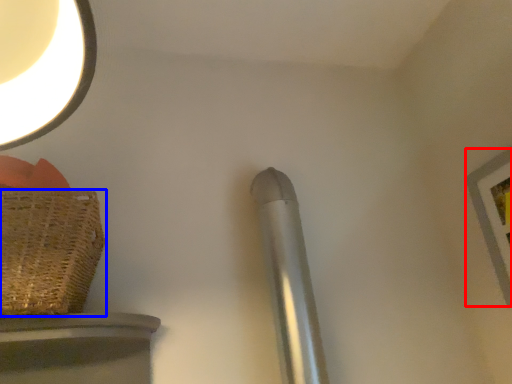
Question: Which object is closer to the camera taking this photo, picture frame (highlighted by a red box) or basket (highlighted by a blue box)?

Choices:
 (A) picture frame
 (B) basket

Answer: (B)